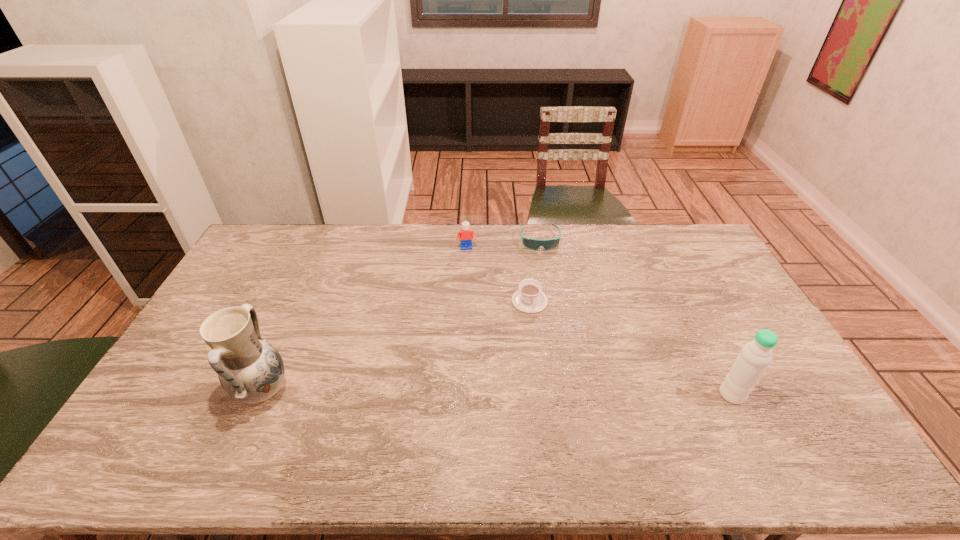
You are a GUI agent. You are given a task and a screenshot of the screen. Output one action in this format:
    pyautogui.click(x=<x>, y=<y>)
    Task: Click on the vacant space on the desktop that is between the pottery and the rightmost object and is positioned on the handle side of the teacup
    
    Given the screenshot: What is the action you would take?
    [x=548, y=393]

This screenshot has width=960, height=540. What are the coordinates of `vacant space on the desktop that is between the leftmost object and the second tallest object and is positioned on the face of the third shortest object` in the screenshot? It's located at (499, 393).

Find the location of `vacant space on the desktop that is between the leftmost object and the fourth shortest object and is positioned on the front-facing side of the sunglasses`. vacant space on the desktop that is between the leftmost object and the fourth shortest object and is positioned on the front-facing side of the sunglasses is located at coordinates (559, 394).